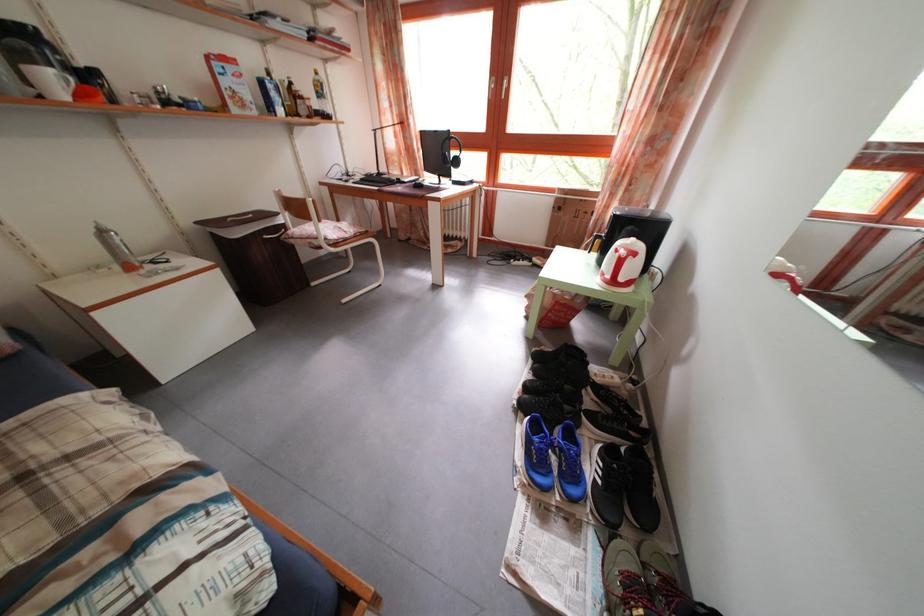
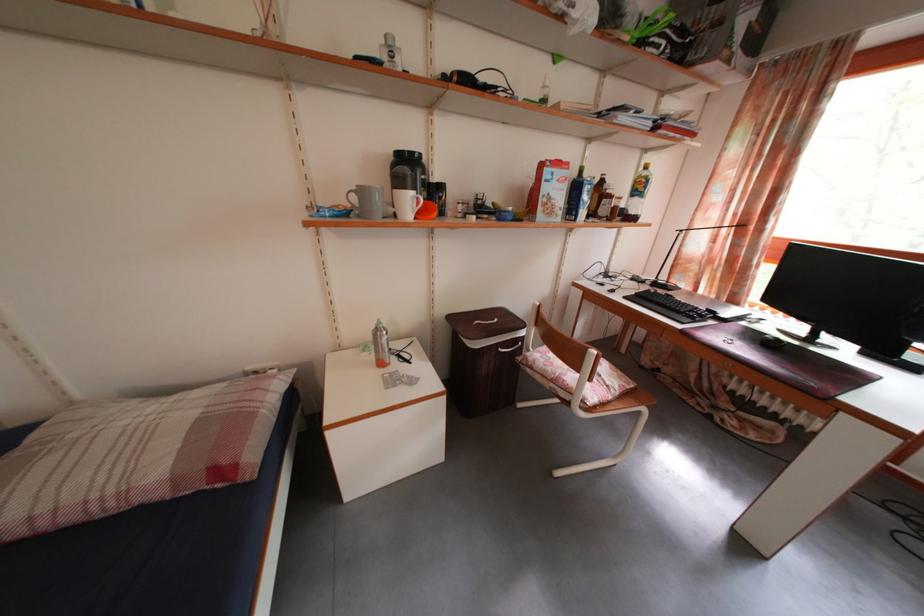
Find the pixel in the second image that matches point 38,98 in the first image.

(398, 217)